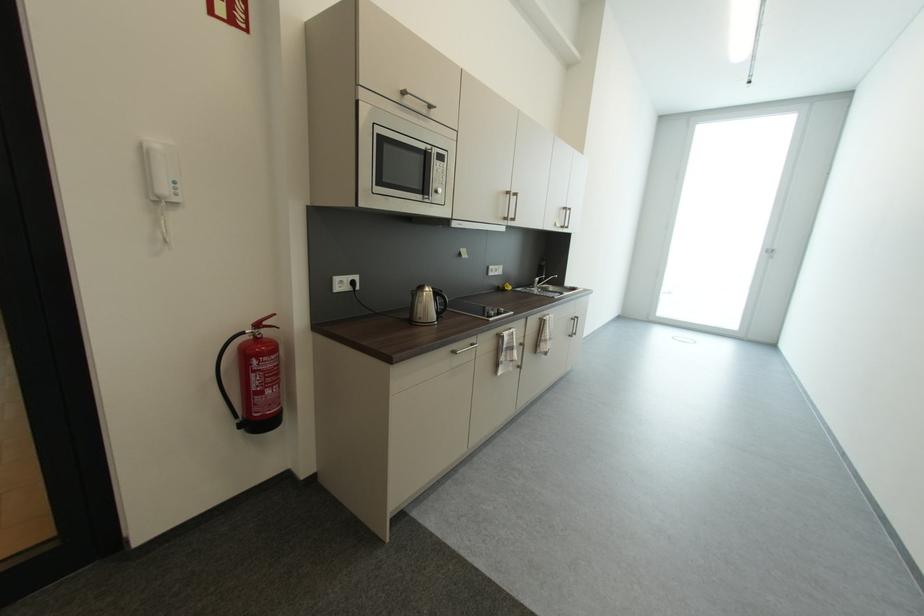
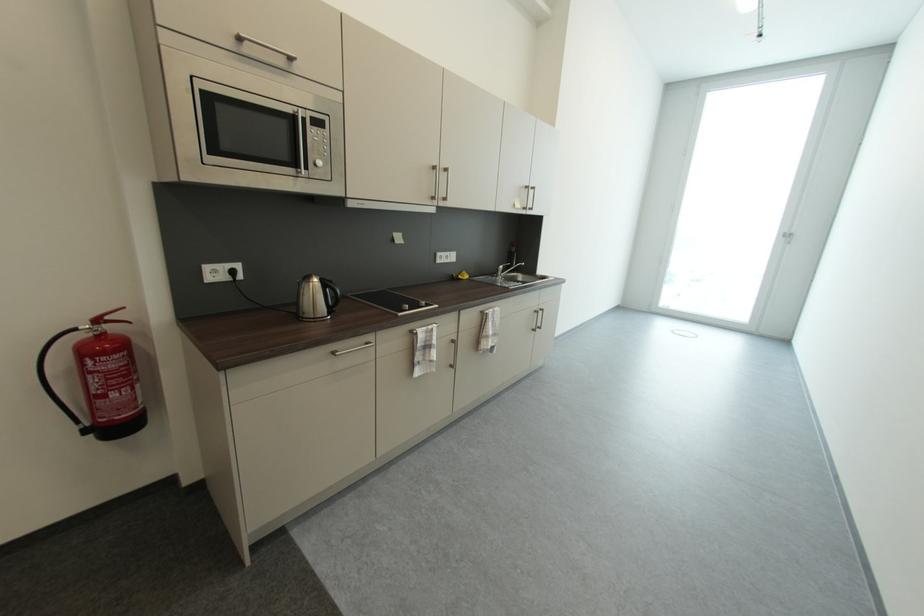
The point at [432,294] is marked in the first image. Where is the corresponding point in the second image?

(317, 285)